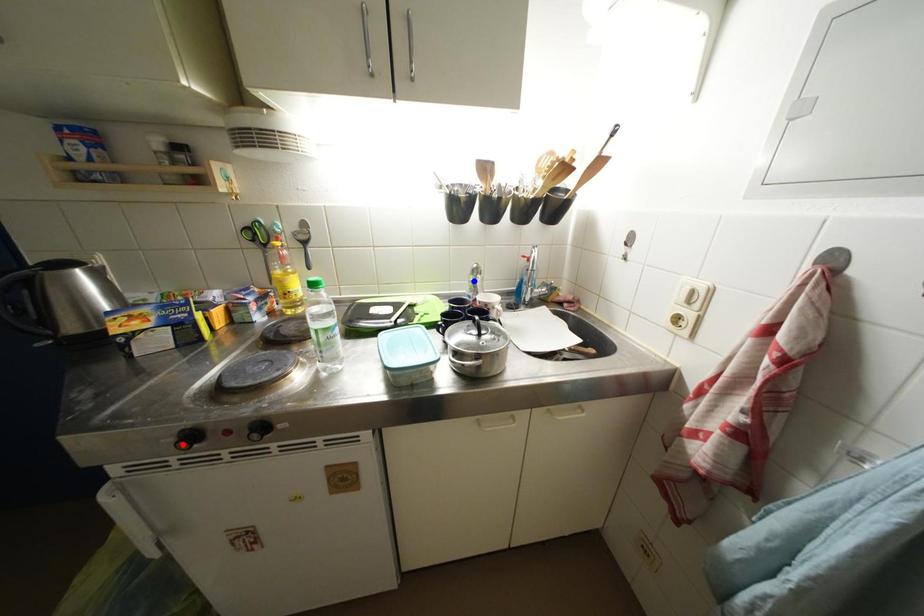
Question: In the image, two points are highlighted. Which point is nearer to the camera? Reply with the corresponding letter.

Choices:
 (A) blue point
 (B) red point

Answer: (B)